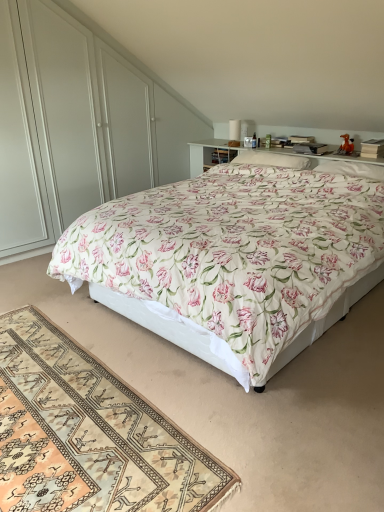
Where is `empty space that is ontop of beige woven rug at lower left (from a real-world perspective)`? empty space that is ontop of beige woven rug at lower left (from a real-world perspective) is located at coordinates (69, 408).